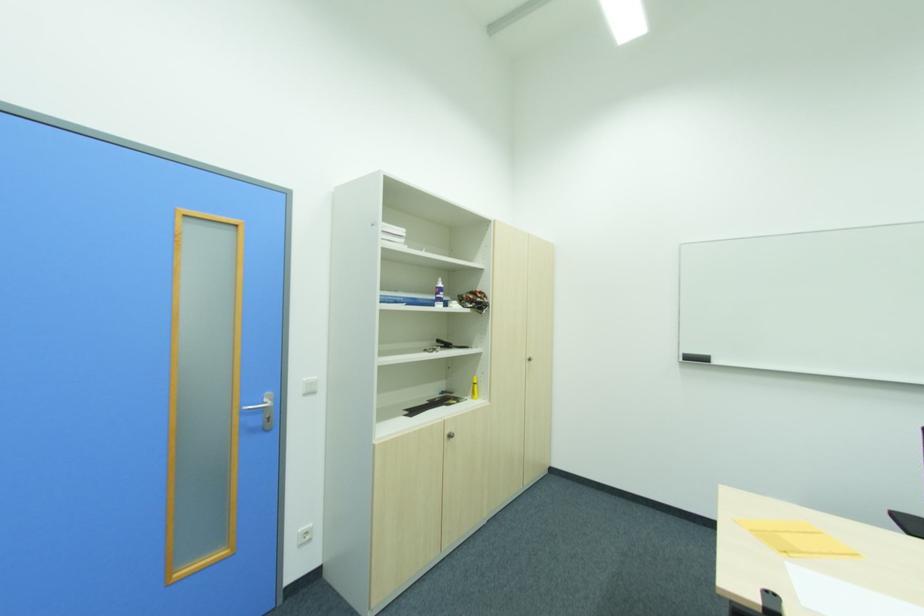
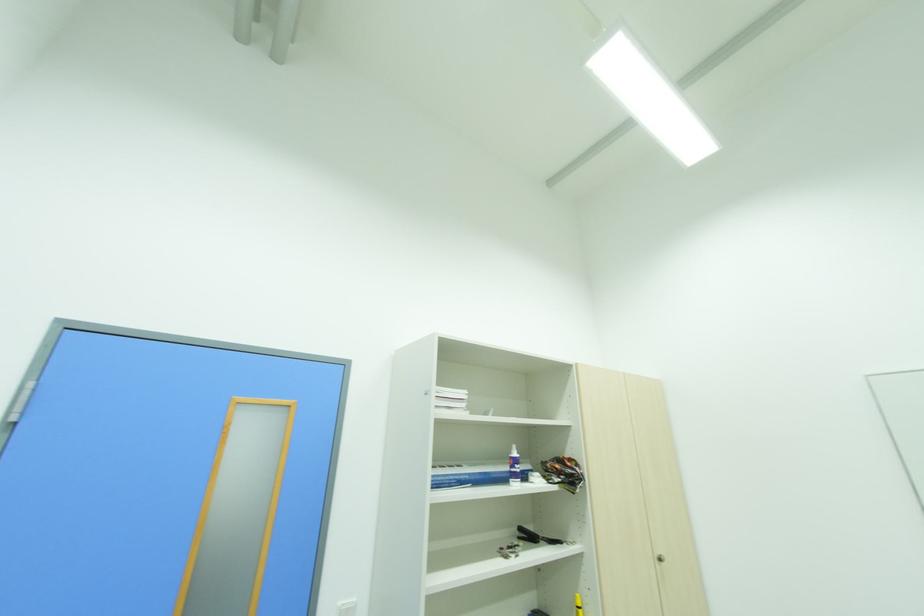
Locate, in the second image, the point that corresponds to point 450,346 in the first image.

(536, 539)